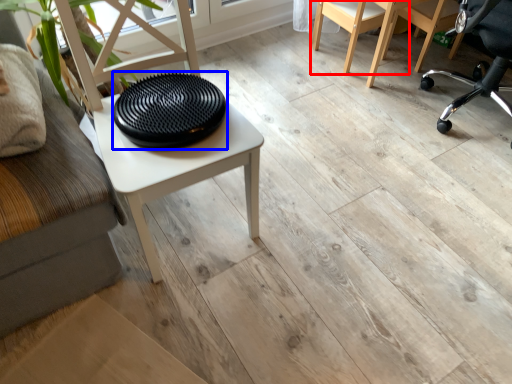
Question: Which point is closer to the camera, chair (highlighted by a red box) or tray (highlighted by a blue box)?

Choices:
 (A) chair
 (B) tray

Answer: (B)